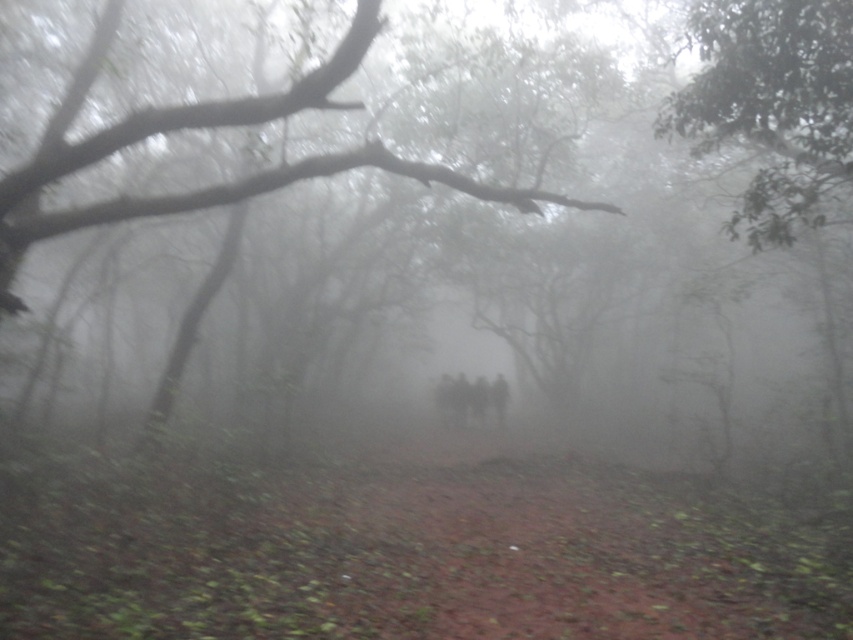
Question: Does brown dirt path at center appear on the left side of green leafy tree at upper right?

Choices:
 (A) yes
 (B) no

Answer: (A)

Question: Which point is farther from the camera taking this photo?

Choices:
 (A) (845, 8)
 (B) (386, 465)
 (C) (318, 97)

Answer: (B)

Question: Is green leafy tree at upper right to the left of smooth bark tree at center from the viewer's perspective?

Choices:
 (A) no
 (B) yes

Answer: (A)

Question: Which of the following is the closest to the observer?

Choices:
 (A) (178, 129)
 (B) (724, 74)
 (C) (740, 596)

Answer: (C)

Question: Is brown dirt path at center thinner than green leafy tree at upper right?

Choices:
 (A) no
 (B) yes

Answer: (A)

Question: Which of the following is the closest to the observer?

Choices:
 (A) (138, 212)
 (B) (820, 582)

Answer: (B)